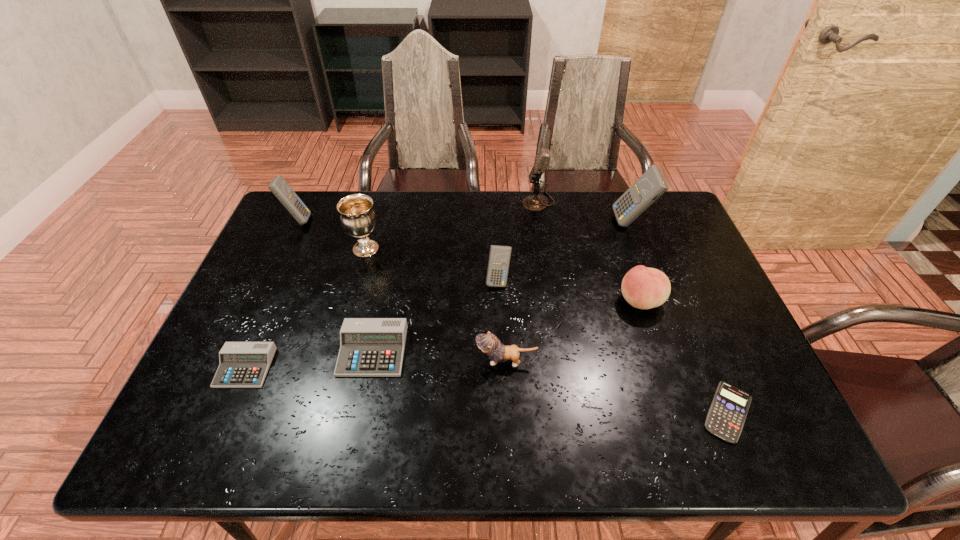
In the image, there is a desktop. What are the coordinates of `free space at the left edge` in the screenshot? It's located at (269, 314).

Find the location of a particular element. This screenshot has width=960, height=540. free space at the right edge of the desktop is located at coordinates (686, 258).

The width and height of the screenshot is (960, 540). In order to click on vacant space at the near right corner of the desktop in this screenshot , I will do `click(751, 448)`.

At what (x,y) coordinates should I click in order to perform the action: click on unoccupied area between the farthest object and the peach. Please return your answer as a coordinate pair (x, y). Looking at the image, I should click on (589, 251).

Identify the location of free space between the second biggest blue calculator and the fourth calculator from left to right. Image resolution: width=960 pixels, height=540 pixels. (397, 250).

Locate an element on the screen. free space between the fourth nearest calculator and the nearest blue calculator is located at coordinates (613, 346).

Where is `empty location between the seventh nearest object and the kitten`? empty location between the seventh nearest object and the kitten is located at coordinates (436, 305).

Image resolution: width=960 pixels, height=540 pixels. Find the location of `vacant space in between the peach and the second shortest object`. vacant space in between the peach and the second shortest object is located at coordinates (443, 334).

What are the coordinates of `unoccupied area between the third smallest blue calculator and the tallest calculator` in the screenshot? It's located at (465, 221).

This screenshot has height=540, width=960. Find the location of `free spot between the nearest blue calculator and the tallest calculator`. free spot between the nearest blue calculator and the tallest calculator is located at coordinates (680, 317).